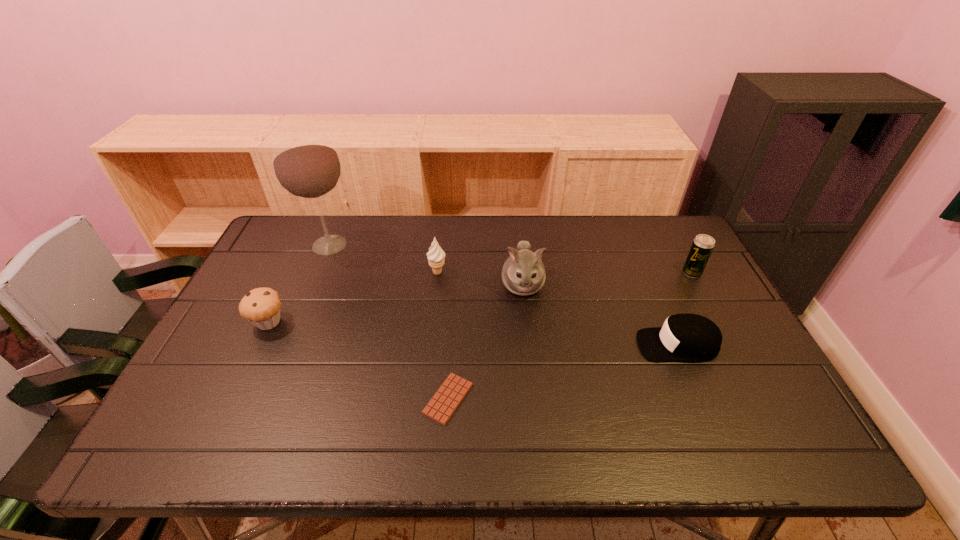
Locate an element on the screen. free space located 0.350m on the front of the farthest object is located at coordinates (286, 351).

In order to click on free space located on the face of the hamster in this screenshot , I will do `click(537, 422)`.

The height and width of the screenshot is (540, 960). In order to click on free spot located on the front-facing side of the icecream in this screenshot , I will do `click(575, 272)`.

Where is `vacant space located on the left of the beer can`? vacant space located on the left of the beer can is located at coordinates (553, 273).

You are a GUI agent. You are given a task and a screenshot of the screen. Output one action in this format:
    pyautogui.click(x=<x>, y=<y>)
    Task: Click on the vacant area situated on the back of the muffin
    The image size is (960, 540).
    Given the screenshot: What is the action you would take?
    pyautogui.click(x=306, y=242)

Locate an element on the screen. The image size is (960, 540). vacant space located on the front-facing side of the cap is located at coordinates (577, 345).

Locate an element on the screen. vacant space located on the front-facing side of the cap is located at coordinates (581, 345).

At what (x,y) coordinates should I click in order to perform the action: click on free point located on the front-facing side of the cap. Please return your answer as a coordinate pair (x, y). This screenshot has height=540, width=960. Looking at the image, I should click on (596, 345).

Find the location of `vacant space situated 0.290m on the back of the candy bar`. vacant space situated 0.290m on the back of the candy bar is located at coordinates (455, 293).

Image resolution: width=960 pixels, height=540 pixels. Find the location of `object situated at the far edge`. object situated at the far edge is located at coordinates (306, 165).